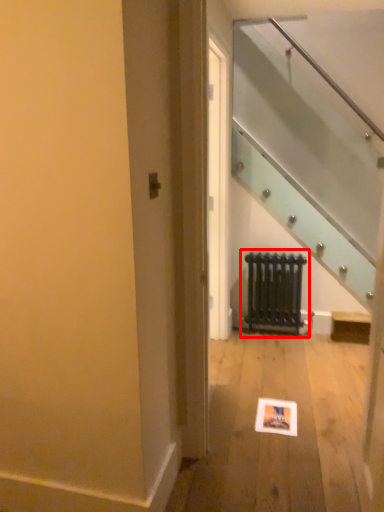
Question: From the image, what is the correct spatial relationship of radiator (annotated by the red box) in relation to picture frame?

Choices:
 (A) left
 (B) right

Answer: (B)